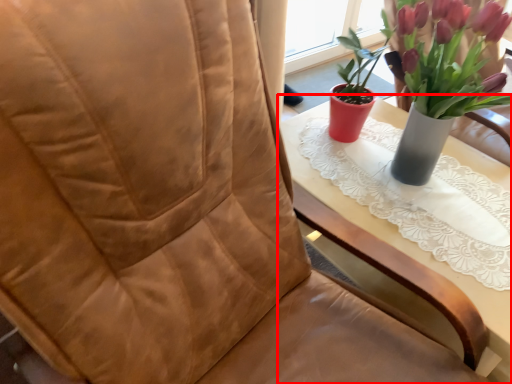
Question: From the image's perspective, what is the correct spatial relationship of table (annotated by the red box) in relation to houseplant?

Choices:
 (A) above
 (B) below

Answer: (B)